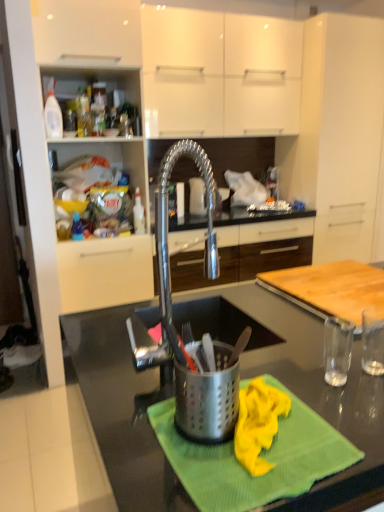
Measure the distance between point (x=56, y=134) and camera.

A distance of 8.15 feet exists between point (x=56, y=134) and camera.

Describe the element at coordinates (302, 381) in the screenshot. I see `metallic gray countertop at center` at that location.

Image resolution: width=384 pixels, height=512 pixels. In order to click on green textured cloth at center in this screenshot , I will do `click(261, 456)`.

What do you see at coordinates (331, 289) in the screenshot? This screenshot has width=384, height=512. I see `wooden cutting board at right` at bounding box center [331, 289].

Image resolution: width=384 pixels, height=512 pixels. What are the coordinates of `translucent plastic bottle at upper left` in the screenshot? It's located at (77, 228).

What do you see at coordinates (220, 73) in the screenshot?
I see `white glossy cabinet at upper center, marked as the 1th cabinetry in a top-to-bottom arrangement` at bounding box center [220, 73].

The width and height of the screenshot is (384, 512). In order to click on white glossy cabinet at upper center, marked as the 1th cabinetry in a top-to-bottom arrangement in this screenshot , I will do `click(220, 73)`.

The image size is (384, 512). Describe the element at coordinates (248, 253) in the screenshot. I see `satin nickel faucet at center, the 1th cabinetry ordered from the bottom` at that location.

The width and height of the screenshot is (384, 512). What are the coordinates of `white plastic bottle at upper left` in the screenshot? It's located at (53, 117).

Is satin nickel faucet at center, the 1th cabinetry ordered from the bottom, facing towards polished stainless steel faucet at center?

Yes, satin nickel faucet at center, the 1th cabinetry ordered from the bottom, is facing polished stainless steel faucet at center.

From a real-world perspective, is satin nickel faucet at center, positioned as the 3th cabinetry in top-to-bottom order, above or below polished stainless steel faucet at center?

From a real-world perspective, satin nickel faucet at center, positioned as the 3th cabinetry in top-to-bottom order, is physically below polished stainless steel faucet at center.

Is satin nickel faucet at center, positioned as the 3th cabinetry in top-to-bottom order, taller or shorter than polished stainless steel faucet at center?

Considering their sizes, satin nickel faucet at center, positioned as the 3th cabinetry in top-to-bottom order, has more height than polished stainless steel faucet at center.

Is satin nickel faucet at center, the 1th cabinetry ordered from the bottom, placed right next to polished stainless steel faucet at center?

satin nickel faucet at center, the 1th cabinetry ordered from the bottom, is not next to polished stainless steel faucet at center, and they're not touching.

Who is bigger, white glossy cabinet at upper center, marked as the 1th cabinetry in a top-to-bottom arrangement, or translucent plastic bottle at upper left?

white glossy cabinet at upper center, marked as the 1th cabinetry in a top-to-bottom arrangement.

From the image's perspective, which is above, white glossy cabinet at upper center, marked as the 1th cabinetry in a top-to-bottom arrangement, or translucent plastic bottle at upper left?

white glossy cabinet at upper center, marked as the 1th cabinetry in a top-to-bottom arrangement.

Is white glossy cabinet at upper center, marked as the 1th cabinetry in a top-to-bottom arrangement, in front of translucent plastic bottle at upper left?

No, white glossy cabinet at upper center, marked as the 1th cabinetry in a top-to-bottom arrangement, is further to the viewer.

Between satin nickel faucet at center, the 1th cabinetry ordered from the bottom, and white plastic bottle at upper left, which one has smaller size?

white plastic bottle at upper left is smaller.

In the scene shown: Does satin nickel faucet at center, positioned as the 3th cabinetry in top-to-bottom order, turn towards white plastic bottle at upper left?

No, satin nickel faucet at center, positioned as the 3th cabinetry in top-to-bottom order, does not turn towards white plastic bottle at upper left.

Considering the relative sizes of satin nickel faucet at center, the 1th cabinetry ordered from the bottom, and white plastic bottle at upper left in the image provided, is satin nickel faucet at center, the 1th cabinetry ordered from the bottom, thinner than white plastic bottle at upper left?

No.

From the image's perspective, would you say satin nickel faucet at center, the 1th cabinetry ordered from the bottom, is positioned over white plastic bottle at upper left?

No.

Is point (180, 382) closer or farther from the camera than point (118, 424)?

Point (180, 382) is closer to the camera than point (118, 424).

What's the angular difference between stainless steel utensil holder at center and metallic gray countertop at center's facing directions?

90.9 degrees separate the facing orientations of stainless steel utensil holder at center and metallic gray countertop at center.

From their relative heights in the image, would you say stainless steel utensil holder at center is taller or shorter than metallic gray countertop at center?

In the image, stainless steel utensil holder at center appears to be shorter than metallic gray countertop at center.

Is stainless steel utensil holder at center turned away from metallic gray countertop at center?

stainless steel utensil holder at center is not turned away from metallic gray countertop at center.

Looking at this image, based on their sizes in the image, would you say metallic gray countertop at center is bigger or smaller than polished stainless steel faucet at center?

In the image, metallic gray countertop at center appears to be larger than polished stainless steel faucet at center.

Considering the sizes of objects metallic gray countertop at center and polished stainless steel faucet at center in the image provided, who is thinner, metallic gray countertop at center or polished stainless steel faucet at center?

polished stainless steel faucet at center is thinner.

Which is in front, point (319, 509) or point (178, 336)?

The point (319, 509) is closer.

You are a GUI agent. You are given a task and a screenshot of the screen. Output one action in this format:
    pyautogui.click(x=<x>, y=<y>)
    Task: Click on the countertop below the polished stainless steel faucet at center (from a real-world perspective)
    This screenshot has width=384, height=512.
    Given the screenshot: What is the action you would take?
    pyautogui.click(x=302, y=381)

In terms of height, does polished stainless steel faucet at center look taller or shorter compared to satin nickel faucet at center, positioned as the 3th cabinetry in top-to-bottom order?

In the image, polished stainless steel faucet at center appears to be shorter than satin nickel faucet at center, positioned as the 3th cabinetry in top-to-bottom order.

Could you tell me if polished stainless steel faucet at center is facing satin nickel faucet at center, the 1th cabinetry ordered from the bottom?

No, polished stainless steel faucet at center is not oriented towards satin nickel faucet at center, the 1th cabinetry ordered from the bottom.

Which is more to the left, polished stainless steel faucet at center or satin nickel faucet at center, the 1th cabinetry ordered from the bottom?

polished stainless steel faucet at center is more to the left.

Is point (140, 365) positioned after point (286, 246)?

No, it is not.

Could you measure the distance between white matte cabinet at upper right, marked as the second cabinetry in a bottom-to-top arrangement, and translucent plastic bottle at upper left?

The distance of white matte cabinet at upper right, marked as the second cabinetry in a bottom-to-top arrangement, from translucent plastic bottle at upper left is 6.69 feet.

From the picture: Is white matte cabinet at upper right, the second cabinetry positioned from the top, positioned far away from translucent plastic bottle at upper left?

Yes, white matte cabinet at upper right, the second cabinetry positioned from the top, and translucent plastic bottle at upper left are quite far apart.

From a real-world perspective, is white matte cabinet at upper right, the second cabinetry positioned from the top, physically above translucent plastic bottle at upper left?

Yes, from a real-world perspective, white matte cabinet at upper right, the second cabinetry positioned from the top, is over translucent plastic bottle at upper left

What's the angular difference between white matte cabinet at upper right, marked as the second cabinetry in a bottom-to-top arrangement, and translucent plastic bottle at upper left's facing directions?

They differ by 0.00117 degrees in their facing directions.

The width and height of the screenshot is (384, 512). I want to click on cabinetry below the polished stainless steel faucet at center (from a real-world perspective), so click(x=248, y=253).

From the image's perspective, which cabinetry is the 2nd one above the translucent plastic bottle at upper left? Please provide its 2D coordinates.

[(220, 73)]

Looking at the image, which one is located closer to white glossy cabinet at upper center, marked as the 1th cabinetry in a top-to-bottom arrangement, white matte cabinet at upper right, the second cabinetry positioned from the top, or green textured cloth at center?

The object closer to white glossy cabinet at upper center, marked as the 1th cabinetry in a top-to-bottom arrangement, is white matte cabinet at upper right, the second cabinetry positioned from the top.

Consider the image. Based on their spatial positions, is polished stainless steel faucet at center or green textured cloth at center closer to wooden cutting board at right?

polished stainless steel faucet at center is closer to wooden cutting board at right.

Based on their spatial positions, is satin nickel faucet at center, positioned as the 3th cabinetry in top-to-bottom order, or white matte cabinet at upper right, marked as the second cabinetry in a bottom-to-top arrangement, further from wooden cutting board at right?

white matte cabinet at upper right, marked as the second cabinetry in a bottom-to-top arrangement, lies further to wooden cutting board at right than the other object.

Estimate the real-world distances between objects in this image. Which object is further from stainless steel utensil holder at center, white plastic bottle at upper left or polished stainless steel faucet at center?

white plastic bottle at upper left.

From the image, which object appears to be farther from white plastic bottle at upper left, green textured cloth at center or stainless steel utensil holder at center?

The object further to white plastic bottle at upper left is green textured cloth at center.

Based on their spatial positions, is green textured cloth at center or metallic gray countertop at center closer to stainless steel utensil holder at center?

The object closer to stainless steel utensil holder at center is green textured cloth at center.

From the image, which object appears to be farther from metallic gray countertop at center, translucent plastic bottle at upper left or satin nickel faucet at center, the 1th cabinetry ordered from the bottom?

Based on the image, translucent plastic bottle at upper left appears to be further to metallic gray countertop at center.

When comparing their distances from polished stainless steel faucet at center, does wooden cutting board at right or white plastic bottle at upper left seem closer?

Based on the image, wooden cutting board at right appears to be nearer to polished stainless steel faucet at center.

At what (x,y) coordinates should I click in order to perform the action: click on counter between metallic gray countertop at center and white glossy cabinet at upper center, which is the third cabinetry in bottom-to-top order, in the front-back direction. Please return your answer as a coordinate pair (x, y). This screenshot has width=384, height=512. Looking at the image, I should click on (331, 289).

The image size is (384, 512). What are the coordinates of `counter between green textured cloth at center and white matte cabinet at upper right, marked as the second cabinetry in a bottom-to-top arrangement, from front to back` in the screenshot? It's located at (331, 289).

Locate an element on the screen. The height and width of the screenshot is (512, 384). appliance between polished stainless steel faucet at center and metallic gray countertop at center in the vertical direction is located at coordinates (208, 398).

The height and width of the screenshot is (512, 384). Identify the location of counter located between polished stainless steel faucet at center and white matte cabinet at upper right, marked as the second cabinetry in a bottom-to-top arrangement, in the depth direction. (331, 289).